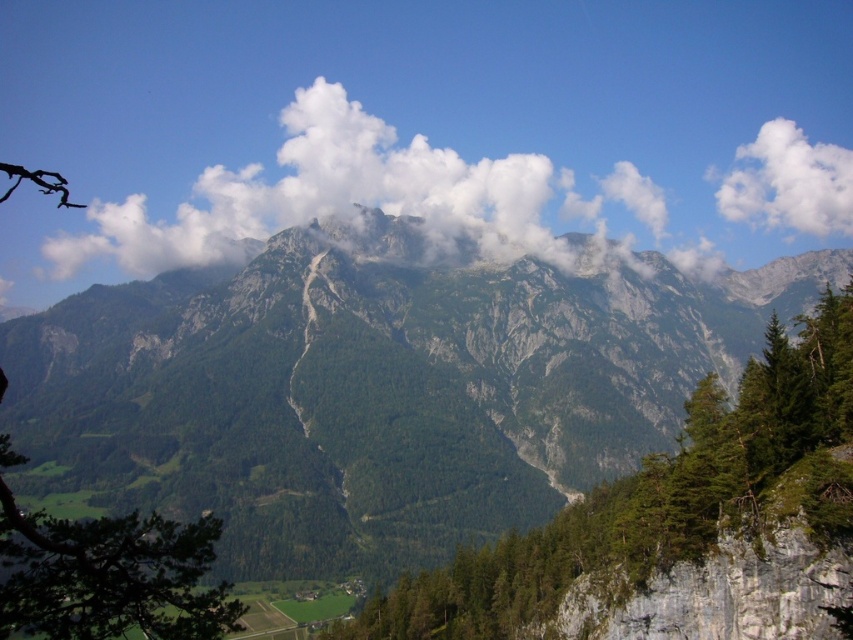
Question: Does green rough rock at center appear on the left side of white fluffy cloud at upper right?

Choices:
 (A) yes
 (B) no

Answer: (A)

Question: Which of the following is the closest to the observer?

Choices:
 (A) (808, 170)
 (B) (831, 323)

Answer: (B)

Question: Which point appears closest to the camera in this image?

Choices:
 (A) (625, 550)
 (B) (811, 195)
 (C) (494, 227)

Answer: (A)

Question: Is green rough rock at center closer to the viewer compared to white fluffy cloud at upper right?

Choices:
 (A) no
 (B) yes

Answer: (B)

Question: Can you confirm if green rough rock at center is smaller than white fluffy cloud at upper right?

Choices:
 (A) yes
 (B) no

Answer: (B)

Question: Based on their relative distances, which object is nearer to the white fluffy cloud at upper right?

Choices:
 (A) white fluffy cloud at upper center
 (B) green rough rock at center

Answer: (A)